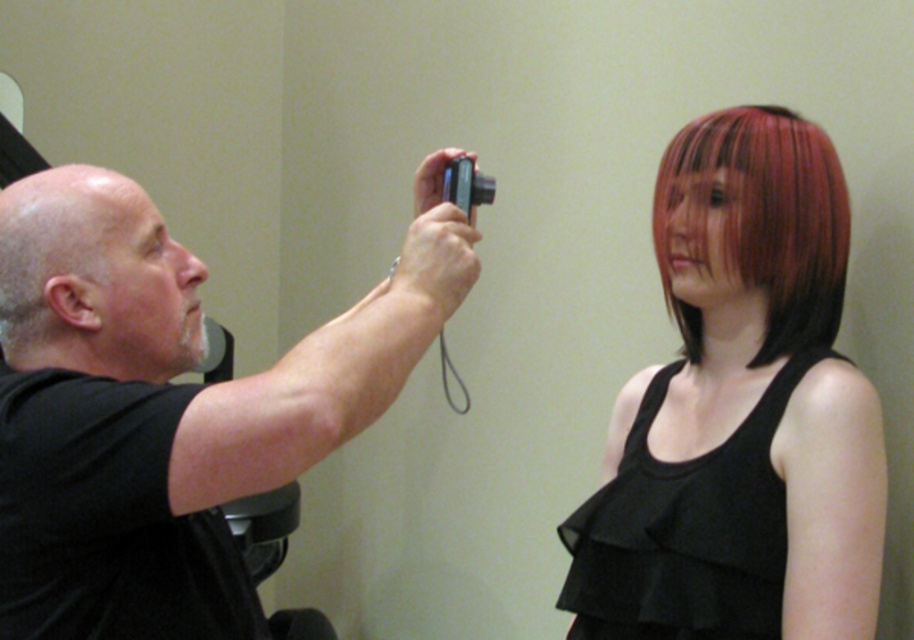
Question: Can you confirm if shiny red hair at upper right is smaller than shiny red hair at right?

Choices:
 (A) no
 (B) yes

Answer: (A)

Question: Where is shiny red hair at upper right located in relation to shiny red hair at right in the image?

Choices:
 (A) left
 (B) right

Answer: (A)

Question: Which point appears closest to the camera in this image?

Choices:
 (A) (339, 404)
 (B) (826, 262)
 (C) (782, 604)

Answer: (A)

Question: Which object is closer to the camera taking this photo?

Choices:
 (A) shiny red hair at upper right
 (B) shiny red hair at right
 (C) black matte camera at upper left

Answer: (C)

Question: Which object appears closest to the camera in this image?

Choices:
 (A) shiny red hair at right
 (B) black matte camera at upper left
 (C) shiny red hair at upper right

Answer: (B)

Question: Considering the relative positions of shiny red hair at upper right and shiny red hair at right in the image provided, where is shiny red hair at upper right located with respect to shiny red hair at right?

Choices:
 (A) left
 (B) right

Answer: (A)